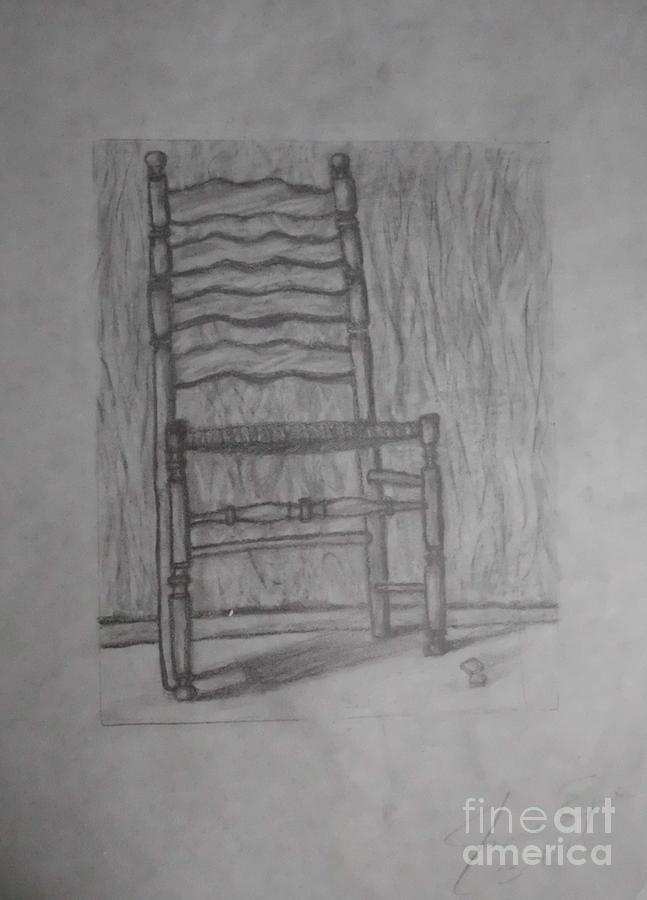
Where is `still legs of chair indicating not a rocking chair`? This screenshot has height=900, width=647. still legs of chair indicating not a rocking chair is located at coordinates (181, 694).